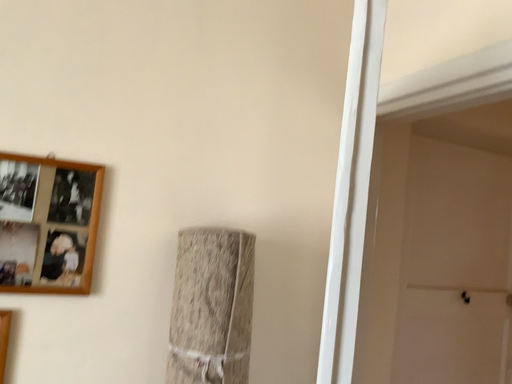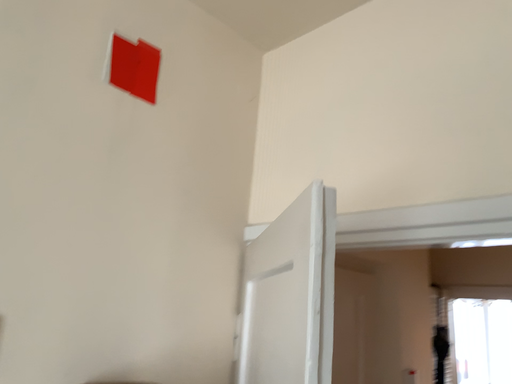
Question: How did the camera likely rotate when shooting the video?

Choices:
 (A) rotated left
 (B) rotated right

Answer: (B)